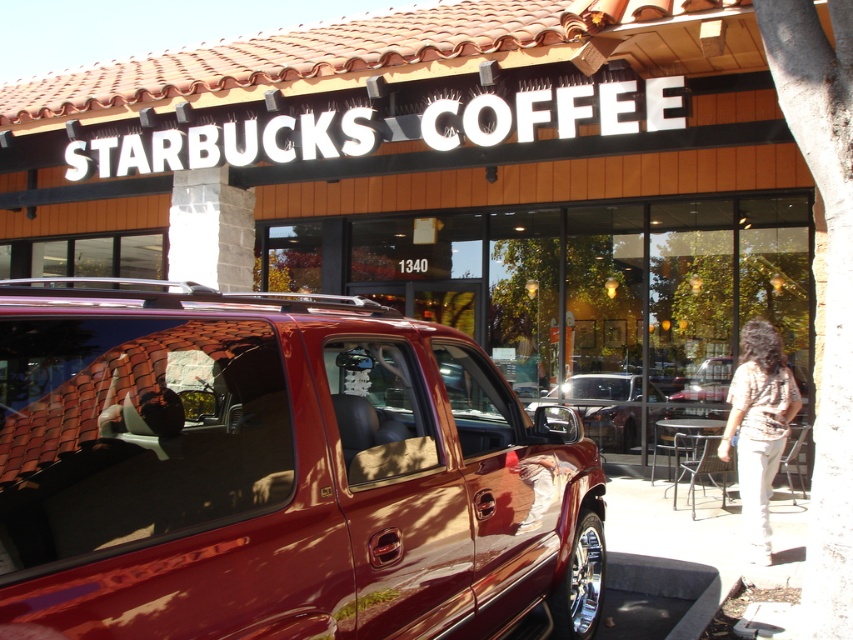
Does point (692, 51) come in front of point (585, 424)?

That is True.

Between matte black sign at center and shiny metallic car at center, which one has more height?

With more height is shiny metallic car at center.

Who is more distant from viewer, [32,106] or [625,426]?

Positioned behind is point [32,106].

Find the location of a particular element. matte black sign at center is located at coordinates (447, 179).

Is beige fabric shirt at lower right behind shiny metallic car at center?

That is False.

The height and width of the screenshot is (640, 853). What do you see at coordinates (758, 428) in the screenshot?
I see `beige fabric shirt at lower right` at bounding box center [758, 428].

Is point (755, 476) positioned after point (630, 440)?

No, it is not.

You are a GUI agent. You are given a task and a screenshot of the screen. Output one action in this format:
    pyautogui.click(x=<x>, y=<y>)
    Task: Click on the beige fabric shirt at lower right
    The width and height of the screenshot is (853, 640).
    Given the screenshot: What is the action you would take?
    pyautogui.click(x=758, y=428)

Is point (395, 508) positioned behind point (614, 396)?

No, (395, 508) is closer to viewer.

Which is behind, point (379, 339) or point (647, 387)?

Point (647, 387)

I want to click on shiny metallic minivan at center, so tap(276, 472).